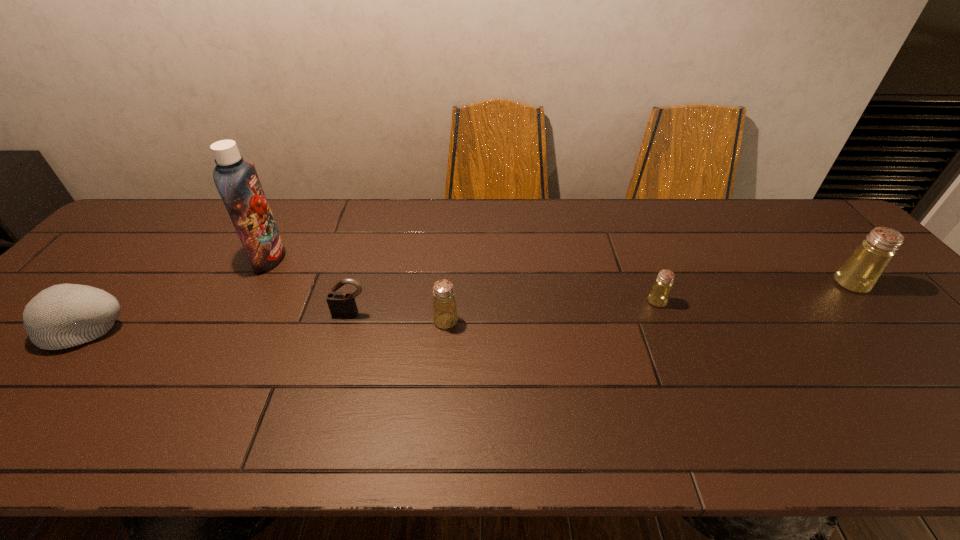
The height and width of the screenshot is (540, 960). I want to click on vacant area at the near edge, so click(228, 408).

This screenshot has height=540, width=960. In the image, there is a desktop. What are the coordinates of `free space at the right edge` in the screenshot? It's located at (851, 292).

This screenshot has width=960, height=540. Find the location of `free space at the far right corner of the desktop`. free space at the far right corner of the desktop is located at coordinates (770, 212).

Locate an element on the screen. empty space between the leftmost object and the second saltshaker from right to left is located at coordinates (372, 314).

I want to click on vacant area between the leftmost object and the second object from right to left, so click(372, 314).

At what (x,y) coordinates should I click in order to perform the action: click on free area in between the rightmost saltshaker and the leftmost saltshaker. Please return your answer as a coordinate pair (x, y). The height and width of the screenshot is (540, 960). Looking at the image, I should click on (648, 302).

Find the location of a particular element. This screenshot has height=540, width=960. free area in between the second object from right to left and the leftmost saltshaker is located at coordinates (551, 311).

The image size is (960, 540). I want to click on free point between the leftmost object and the second tallest saltshaker, so click(x=267, y=323).

The image size is (960, 540). Find the location of `free space between the nearest saltshaker and the second object from right to left`. free space between the nearest saltshaker and the second object from right to left is located at coordinates (551, 311).

Identify the location of free area in between the tallest object and the padlock. This screenshot has height=540, width=960. 310,285.